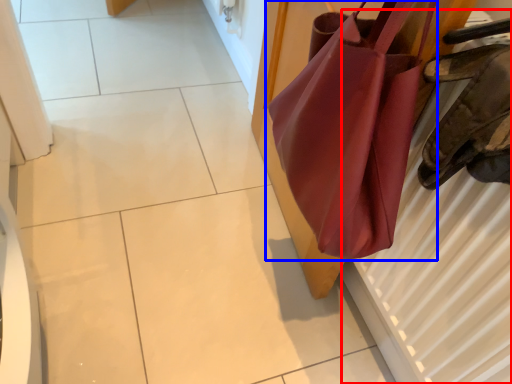
Question: Among these objects, which one is farthest to the camera, radiator (highlighted by a red box) or handbag (highlighted by a blue box)?

Choices:
 (A) radiator
 (B) handbag

Answer: (B)